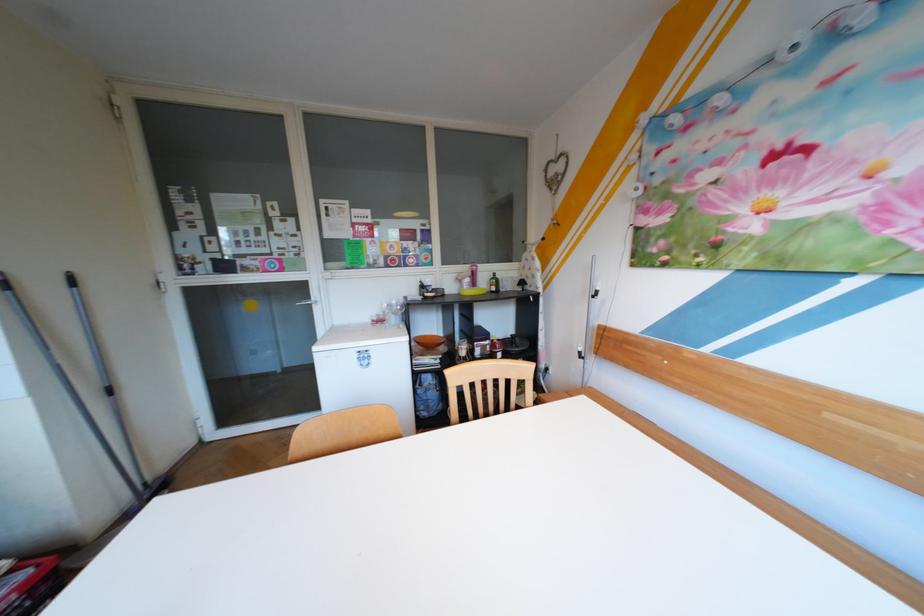
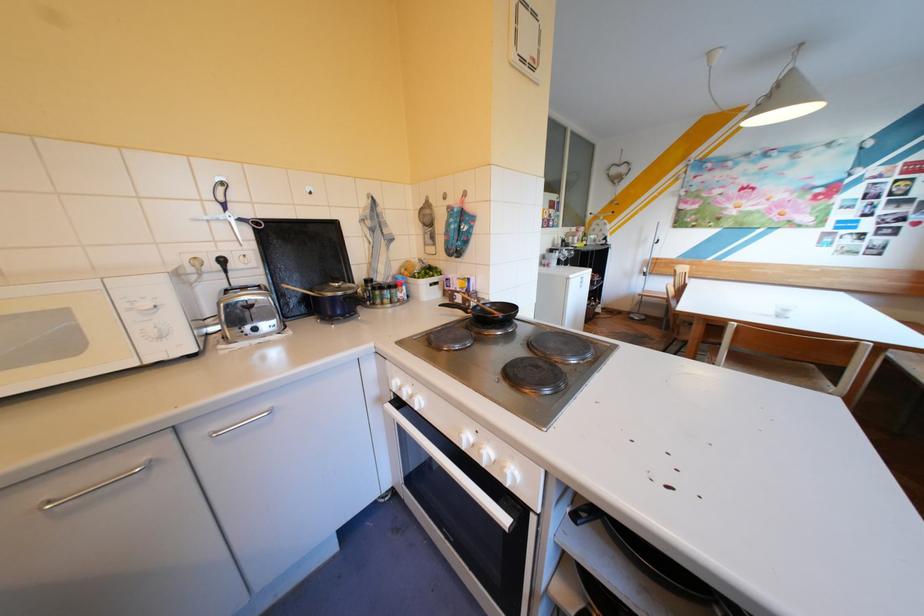
Question: I am providing you with two images of the same scene from different viewpoints. Which of the following objects are not visible in image2?

Choices:
 (A) brown ceramic bowl
 (B) white oven handle
 (C) white tissue roll
 (D) white microwave dial

Answer: (A)